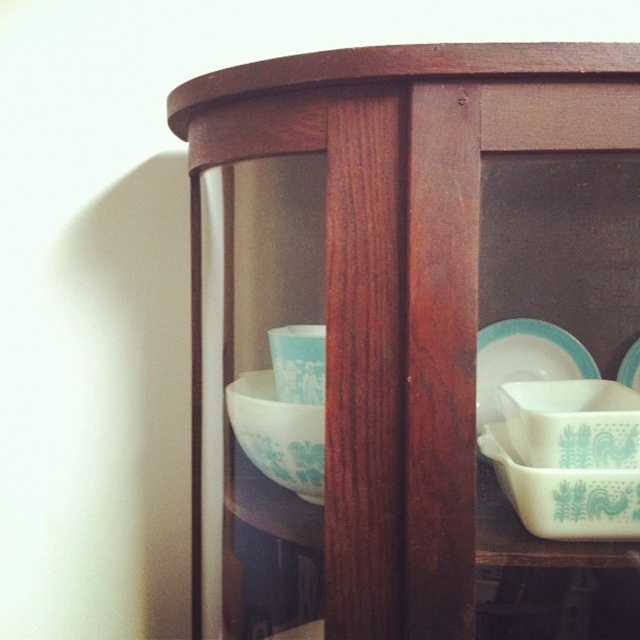
Can you confirm if white glossy casserole dish at right is wider than teal glossy bowl at center?

Indeed, white glossy casserole dish at right has a greater width compared to teal glossy bowl at center.

Identify the location of white glossy casserole dish at right. (572, 422).

Locate an element on the screen. white glossy casserole dish at right is located at coordinates (572, 422).

Is white glossy plate at center closer to camera compared to teal ceramic plate at center?

Yes, white glossy plate at center is in front of teal ceramic plate at center.

In order to click on white glossy plate at center in this screenshot , I will do `click(524, 360)`.

Who is more distant from viewer, (534,346) or (637,348)?

Point (534,346)

Identify the location of white glossy plate at center. The width and height of the screenshot is (640, 640). (524, 360).

Based on the photo, does wooden cabinet at center appear under white glossy plate at center?

Indeed, wooden cabinet at center is positioned under white glossy plate at center.

Measure the distance between wooden cabinet at center and camera.

wooden cabinet at center and camera are 49.40 centimeters apart.

Is point (337, 160) farther from viewer compared to point (536, 326)?

That is False.

This screenshot has height=640, width=640. Find the location of `wooden cabinet at center`. wooden cabinet at center is located at coordinates (404, 324).